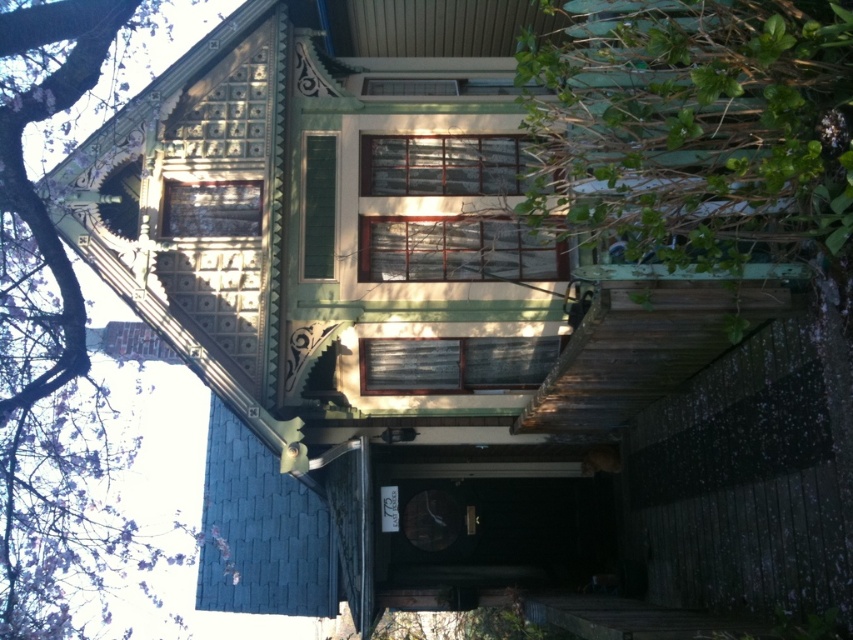
Consider the image. You are a landscape designer planning to replace the green leafy bush at right and the purple leafy tree at upper left with new plants. If you want to keep the same spatial proportions, which plant should you choose a wider one or a narrower one for each spot?

For the spot where the green leafy bush at right is currently located, you should choose a wider plant since its current width is larger than the purple leafy tree at upper left. For the purple leafy tree at upper left, select a narrower plant to maintain the existing spatial proportions.

You are standing in front of the historic house and want to water the green leafy bush at right. If your watering can has a range of 15 feet, will you be able to reach the bush without moving closer?

The green leafy bush at right is 20.92 feet away from the viewer. Since the watering can only reaches 15 feet, you will need to move closer to water the bush.

You are standing in front of the historic house and want to take a photo of the front door. However, there are two plants blocking the view slightly. Which plant is closer to you, the green leafy bush at right or the purple leafy tree at upper left?

The green leafy bush at right is closer to you because it is in front of the purple leafy tree at upper left, so it is blocking the view more directly.